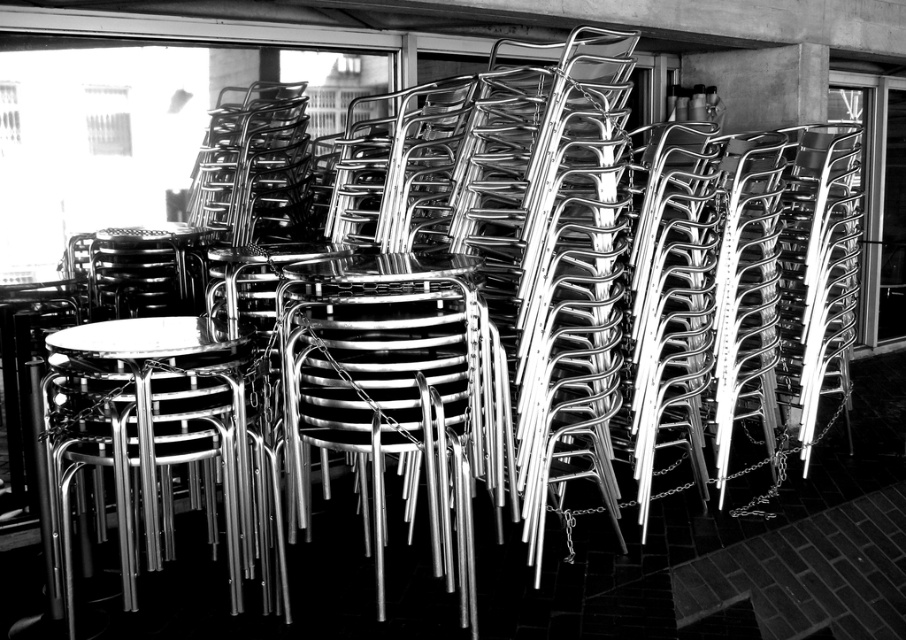
Is the position of metallic silver chair at center less distant than that of polished metal table at center?

No, metallic silver chair at center is behind polished metal table at center.

Who is more forward, (439, 323) or (255, 525)?

Point (439, 323) is more forward.

Locate an element on the screen. This screenshot has height=640, width=906. metallic silver chair at center is located at coordinates (397, 401).